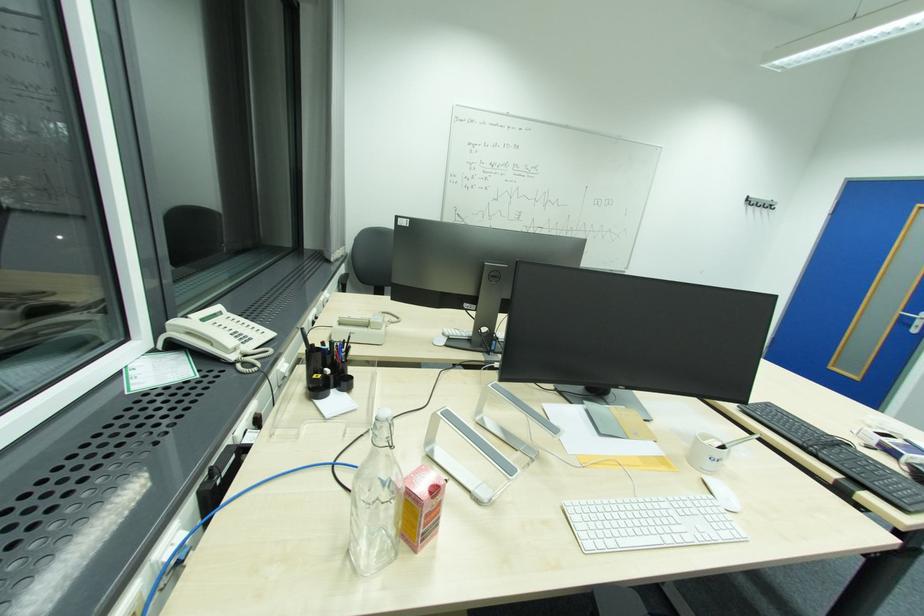
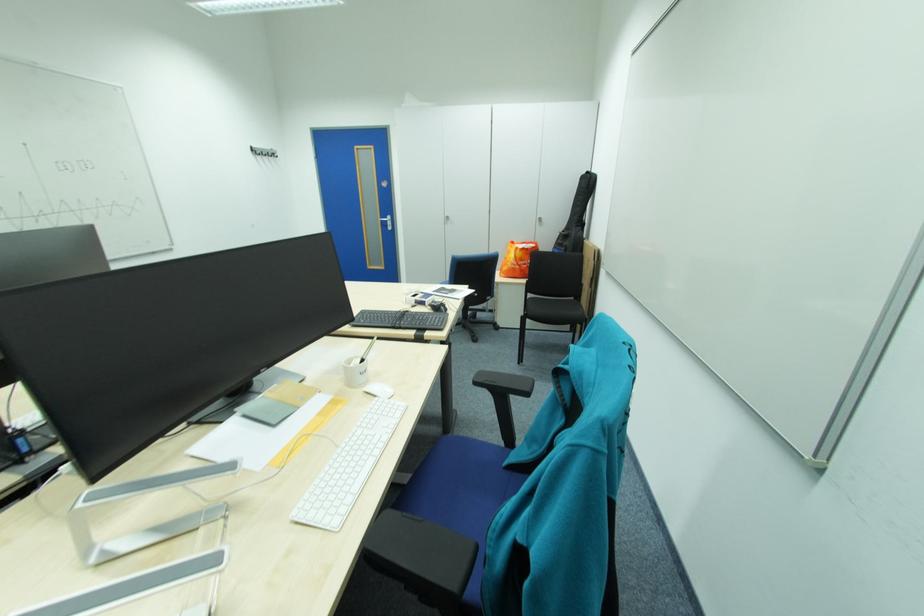
Find the pixel in the second image that matches (727,440) in the first image.

(367, 357)